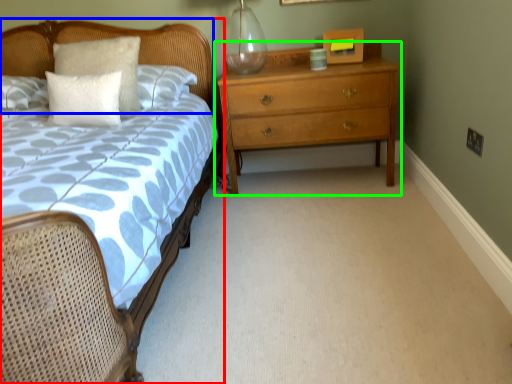
Question: Considering the real-world distances, which object is closest to bed (highlighted by a red box)? headboard (highlighted by a blue box) or chest of drawers (highlighted by a green box).

Choices:
 (A) headboard
 (B) chest of drawers

Answer: (A)